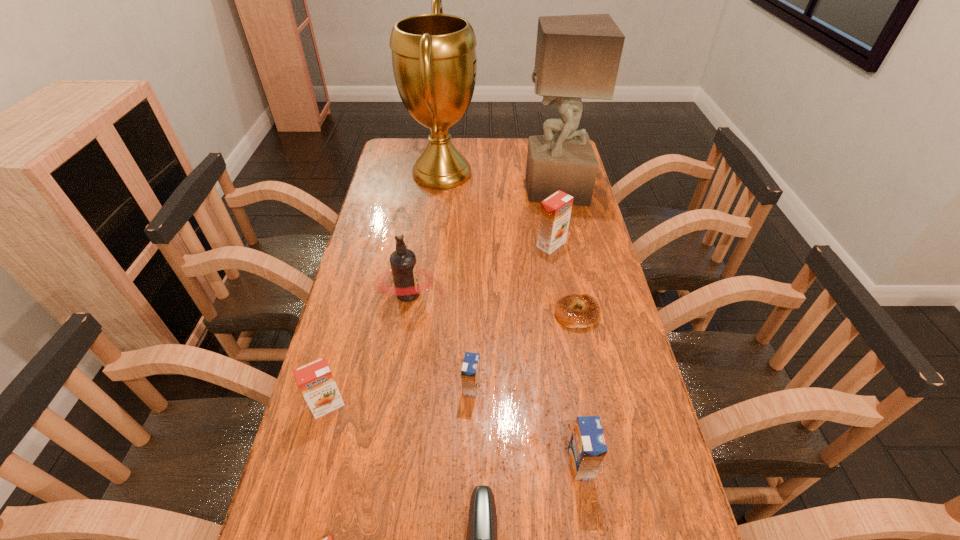
What are the coordinates of `gold trophy cup` in the screenshot? It's located at (434, 62).

Identify the location of sculpture. This screenshot has width=960, height=540. (577, 56).

Locate an element on the screen. The height and width of the screenshot is (540, 960). root beer is located at coordinates (403, 263).

Identify the location of the farthest orange juice. The height and width of the screenshot is (540, 960). (555, 212).

Find the location of a particular element. the biggest orange orange juice is located at coordinates (555, 212).

The image size is (960, 540). Find the location of `the leftmost object`. the leftmost object is located at coordinates (315, 380).

Identify the location of the second biggest orange orange juice. Image resolution: width=960 pixels, height=540 pixels. (315, 380).

Locate an element on the screen. the nearer blue orange_juice is located at coordinates (587, 448).

Locate an element on the screen. This screenshot has width=960, height=540. the fourth farthest orange juice is located at coordinates point(587,448).

What are the coordinates of `the smaller blue orange_juice` in the screenshot? It's located at (470, 373).